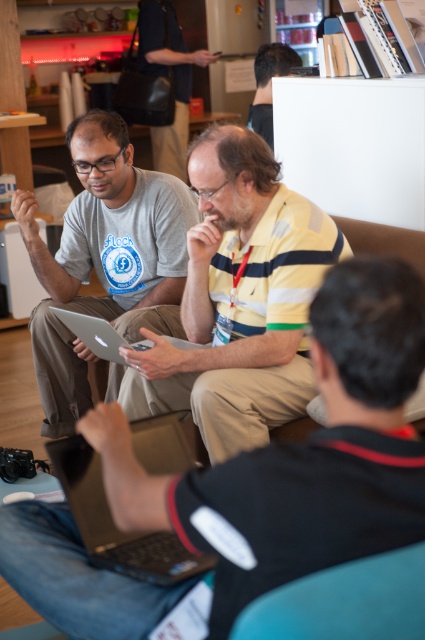
Question: Does yellow striped shirt at center lie in front of black matte hair at upper center?

Choices:
 (A) yes
 (B) no

Answer: (A)

Question: Which object appears closest to the camera in this image?

Choices:
 (A) black matte hair at upper center
 (B) yellow striped shirt at center

Answer: (B)

Question: Among these objects, which one is farthest from the camera?

Choices:
 (A) metallic silver laptop at lower center
 (B) matte gray laptop at center
 (C) matte black bag at upper center
 (D) black matte hair at upper center

Answer: (C)

Question: Does yellow striped shirt at center lie in front of silver metallic laptop at center?

Choices:
 (A) yes
 (B) no

Answer: (A)

Question: Among these objects, which one is farthest from the camera?

Choices:
 (A) yellow striped shirt at center
 (B) silver metallic laptop at center

Answer: (B)

Question: Considering the relative positions of metallic silver laptop at lower center and matte black bag at upper center in the image provided, where is metallic silver laptop at lower center located with respect to matte black bag at upper center?

Choices:
 (A) right
 (B) left

Answer: (A)